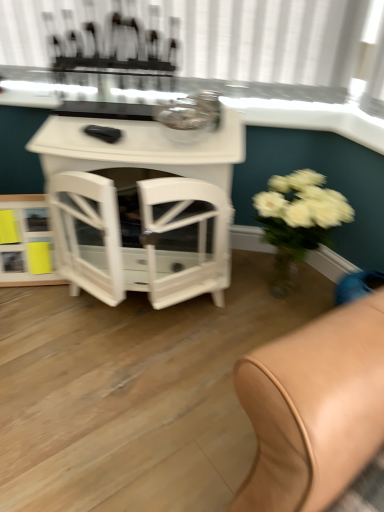
Question: From their relative heights in the image, would you say white glossy shelf at lower left is taller or shorter than white glossy table at center?

Choices:
 (A) short
 (B) tall

Answer: (A)

Question: Is white glossy shelf at lower left spatially inside white glossy table at center, or outside of it?

Choices:
 (A) inside
 (B) outside

Answer: (B)

Question: Which object is the closest to the white glossy table at center?

Choices:
 (A) white glossy shelf at lower left
 (B) white matte vase at right
 (C) clear glass table at upper center
 (D) white glossy window sill at upper center

Answer: (D)

Question: Estimate the real-world distances between objects in this image. Which object is closer to the white glossy table at center?

Choices:
 (A) white glossy shelf at lower left
 (B) white glossy window sill at upper center
 (C) clear glass table at upper center
 (D) white matte vase at right

Answer: (B)